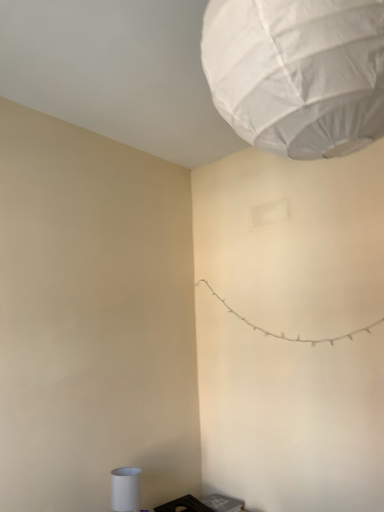
Question: Considering the positions of point (198, 504) and point (271, 47), is point (198, 504) closer or farther from the camera than point (271, 47)?

Choices:
 (A) farther
 (B) closer

Answer: (A)

Question: In terms of height, does black plastic laptop at lower right look taller or shorter compared to white fabric lantern at upper center?

Choices:
 (A) tall
 (B) short

Answer: (B)

Question: Which object is the closest to the white matte cylinder at lower left?

Choices:
 (A) black plastic laptop at lower right
 (B) white fabric lantern at upper center

Answer: (A)

Question: Estimate the real-world distances between objects in this image. Which object is closer to the black plastic laptop at lower right?

Choices:
 (A) white matte cylinder at lower left
 (B) white fabric lantern at upper center

Answer: (A)